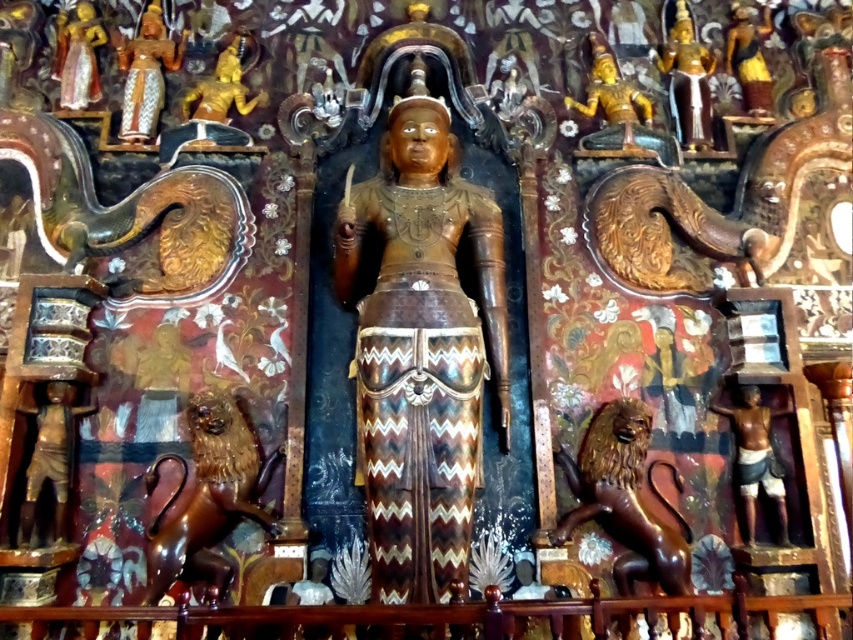
You are an art conservator assessing the spatial arrangement of the temple panel. The bronze figure at lower left and the gold polished statue at upper center are key elements. Based on their sizes, which one appears more prominent in the composition?

The gold polished statue at upper center appears more prominent because it is taller than the bronze figure at lower left.

You are an art conservator assessing the wooden panel. You notice two bronze figures on either side of the central deity. Based on their size, which bronze figure at lower right or bronze figure at lower left might require more structural support due to its weight?

The bronze figure at lower right is bigger than bronze figure at lower left, so it likely requires more structural support due to its larger size and potential weight.

You are an architect designing a new temple and want to place a statue of a deity in the center. You have a shiny brown lion that needs to be positioned at point (207,497). According to the image, where should you place the shiny brown lion?

The shiny brown lion should be placed at the lower left position since the shiny brown lion at lower left is located at point (207,497).